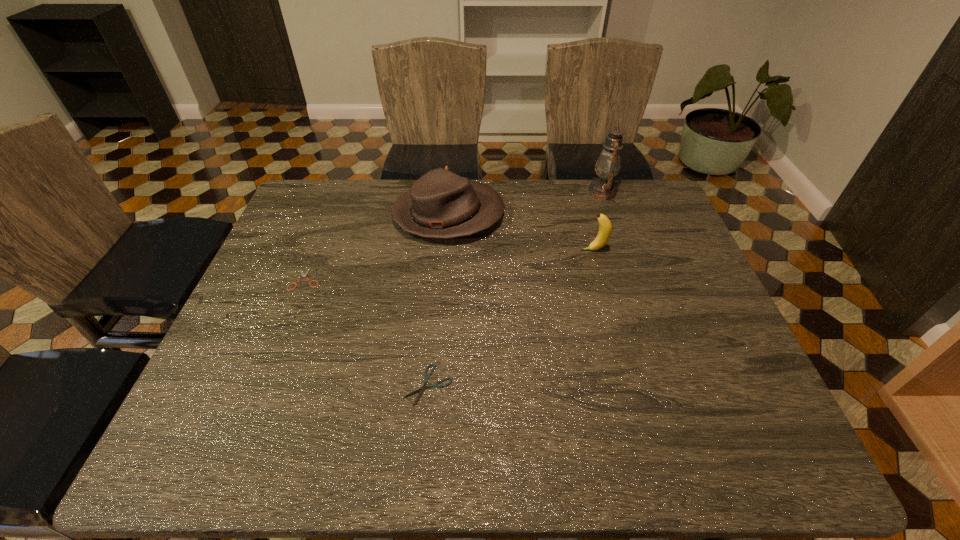
You are a GUI agent. You are given a task and a screenshot of the screen. Output one action in this format:
    pyautogui.click(x=<x>, y=<y>)
    Task: Click on the vacant area that lies between the hat and the banana
    
    Given the screenshot: What is the action you would take?
    pyautogui.click(x=521, y=233)

Identify which object is located as the second nearest to the nearest object. Please provide its 2D coordinates. Your answer should be formatted as a tuple, i.e. [(x, y)], where the tuple contains the x and y coordinates of a point satisfying the conditions above.

[(441, 204)]

Identify which object is the closest to the hat. Please provide its 2D coordinates. Your answer should be formatted as a tuple, i.e. [(x, y)], where the tuple contains the x and y coordinates of a point satisfying the conditions above.

[(303, 275)]

This screenshot has height=540, width=960. I want to click on free spot that satisfies the following two spatial constraints: 1. on the front side of the tallest object; 2. from the stem of the banana, so click(622, 250).